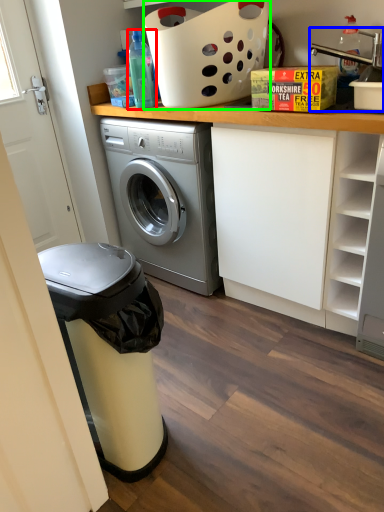
Question: Which is nearer to the bottle (highlighted by a red box)? sink (highlighted by a blue box) or basket (highlighted by a green box).

Choices:
 (A) sink
 (B) basket

Answer: (B)